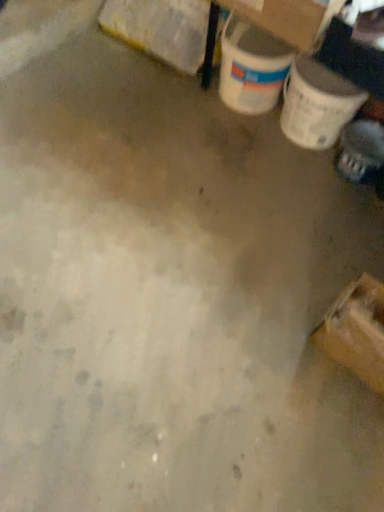
Question: From the image's perspective, is yellow cardboard box at upper left, which is the 2th cardboard box in front-to-back order, positioned above or below shiny black shoe at lower right?

Choices:
 (A) above
 (B) below

Answer: (A)

Question: Considering the positions of yellow cardboard box at upper left, marked as the 1th cardboard box in a left-to-right arrangement, and shiny black shoe at lower right in the image, is yellow cardboard box at upper left, marked as the 1th cardboard box in a left-to-right arrangement, taller or shorter than shiny black shoe at lower right?

Choices:
 (A) short
 (B) tall

Answer: (B)

Question: Estimate the real-world distances between objects in this image. Which object is farther from the yellow cardboard box at upper left, marked as the 1th cardboard box in a left-to-right arrangement?

Choices:
 (A) cardboard box at upper right, the 2th cardboard box from the left
 (B) shiny black shoe at lower right

Answer: (B)

Question: Which object is positioned closest to the cardboard box at upper right, placed as the second cardboard box when sorted from back to front?

Choices:
 (A) shiny black shoe at lower right
 (B) yellow cardboard box at upper left, marked as the 1th cardboard box in a left-to-right arrangement

Answer: (B)